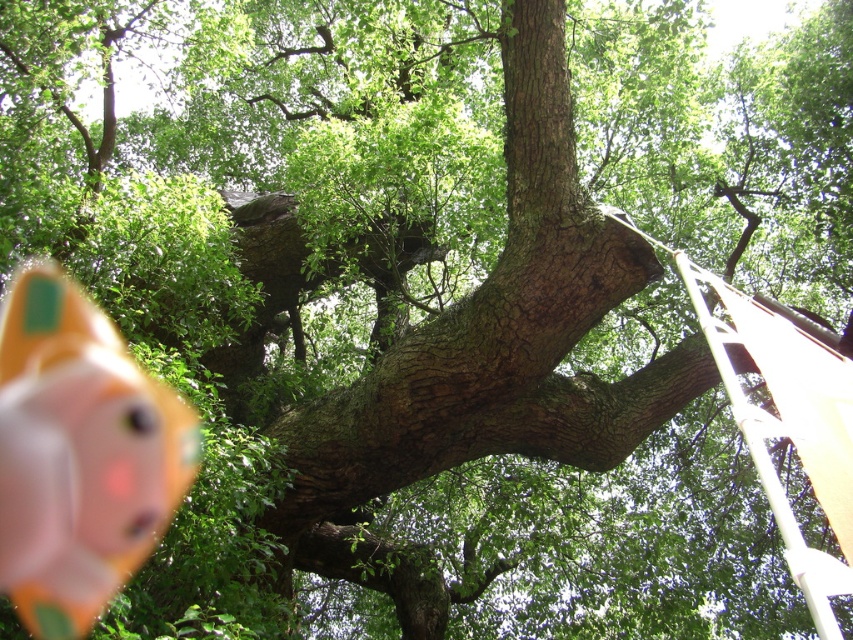
Question: Can you confirm if pink rubber duck at lower left is smaller than white plastic ladder at right?

Choices:
 (A) yes
 (B) no

Answer: (A)

Question: Is pink rubber duck at lower left to the right of white plastic ladder at right from the viewer's perspective?

Choices:
 (A) yes
 (B) no

Answer: (B)

Question: Where is pink rubber duck at lower left located in relation to white plastic ladder at right in the image?

Choices:
 (A) right
 (B) left

Answer: (B)

Question: Which of the following is the farthest from the observer?

Choices:
 (A) white plastic ladder at right
 (B) pink rubber duck at lower left

Answer: (B)

Question: Among these points, which one is nearest to the camera?

Choices:
 (A) (28, 324)
 (B) (782, 522)

Answer: (B)